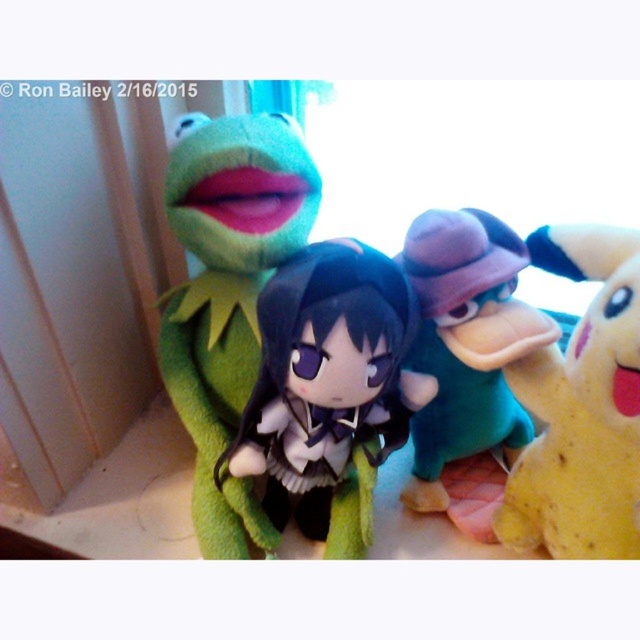
Question: Which of these objects is positioned closest to the yellow plush toy at right?

Choices:
 (A) teal plush duck at center
 (B) satin black doll at center
 (C) velvet green plush frog at upper left

Answer: (C)

Question: Which object is the farthest from the velvet green plush frog at upper left?

Choices:
 (A) teal plush duck at center
 (B) yellow plush toy at right

Answer: (B)

Question: Is velvet green plush frog at upper left below yellow plush toy at right?

Choices:
 (A) yes
 (B) no

Answer: (B)

Question: Can you confirm if satin black doll at center is smaller than yellow plush toy at right?

Choices:
 (A) no
 (B) yes

Answer: (A)

Question: Estimate the real-world distances between objects in this image. Which object is farther from the green plush frog at upper left?

Choices:
 (A) satin black doll at center
 (B) teal plush duck at center
 (C) yellow plush toy at right
 (D) velvet green plush frog at upper left

Answer: (C)

Question: Is velvet green plush frog at upper left wider than yellow plush toy at right?

Choices:
 (A) yes
 (B) no

Answer: (A)